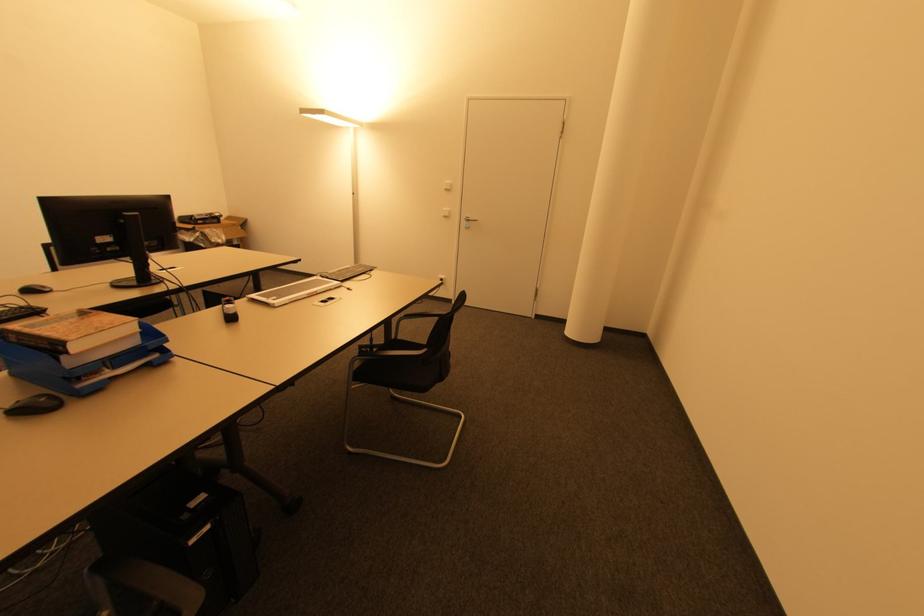
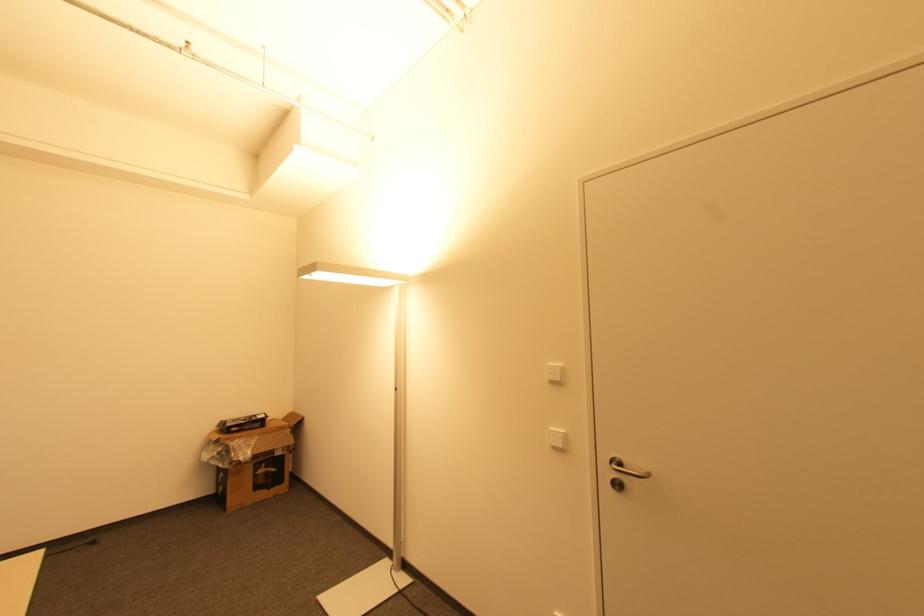
Locate, in the second image, the point that corresponds to the point at 446,217 in the first image.

(557, 448)